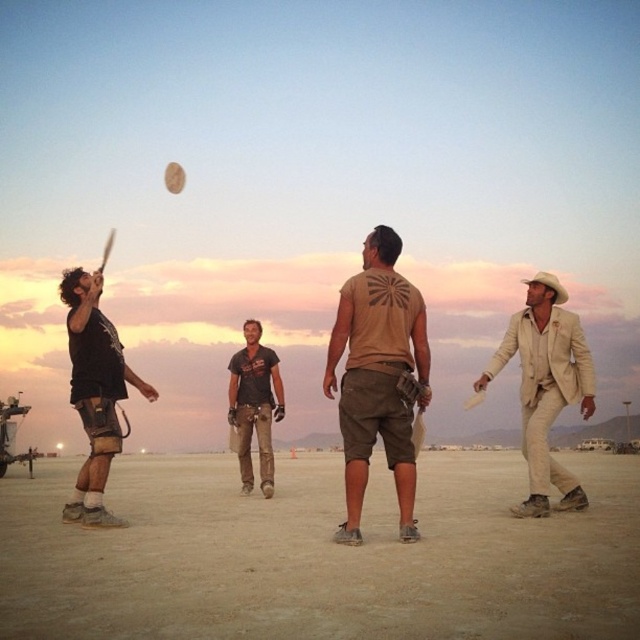
Can you confirm if black matte t-shirt at left is positioned below dark brown leather pants at center?

Actually, black matte t-shirt at left is above dark brown leather pants at center.

How far apart are black matte t-shirt at left and dark brown leather pants at center?

A distance of 7.77 meters exists between black matte t-shirt at left and dark brown leather pants at center.

Who is more forward, (106, 324) or (282, 417)?

Point (106, 324) is in front.

The height and width of the screenshot is (640, 640). I want to click on black matte t-shirt at left, so click(x=93, y=392).

Is point (404, 356) closer to camera compared to point (92, 432)?

Yes, point (404, 356) is closer to viewer.

Can you confirm if tan cotton t-shirt at center is positioned to the left of black matte t-shirt at left?

No, tan cotton t-shirt at center is not to the left of black matte t-shirt at left.

The image size is (640, 640). What do you see at coordinates (378, 376) in the screenshot?
I see `tan cotton t-shirt at center` at bounding box center [378, 376].

I want to click on tan cotton t-shirt at center, so click(x=378, y=376).

Which is more to the right, beige suit at right or black matte t-shirt at left?

beige suit at right

Who is taller, beige suit at right or black matte t-shirt at left?

With more height is beige suit at right.

Locate an element on the screen. beige suit at right is located at coordinates (545, 387).